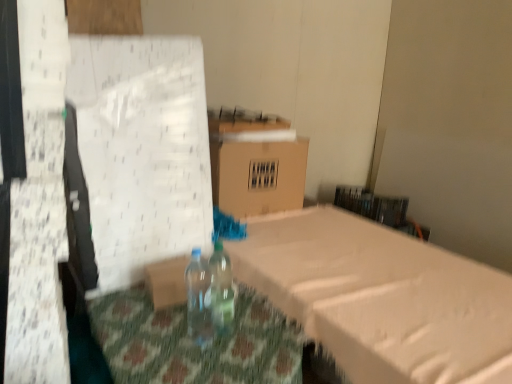
Question: Is transparent plastic bottle at center, the 2th bottle when ordered from left to right, behind brown cardboard box at center?

Choices:
 (A) no
 (B) yes

Answer: (A)

Question: From a real-world perspective, is transparent plastic bottle at center, the 2th bottle when ordered from left to right, on top of brown cardboard box at center?

Choices:
 (A) yes
 (B) no

Answer: (B)

Question: Can you confirm if transparent plastic bottle at center, the first bottle when ordered from right to left, is smaller than brown cardboard box at center?

Choices:
 (A) yes
 (B) no

Answer: (A)

Question: Is transparent plastic bottle at center, the first bottle when ordered from right to left, taller than brown cardboard box at center?

Choices:
 (A) yes
 (B) no

Answer: (B)

Question: Is transparent plastic bottle at center, the 2th bottle when ordered from left to right, located outside brown cardboard box at center?

Choices:
 (A) no
 (B) yes

Answer: (B)

Question: From a real-world perspective, is transparent plastic bottle at center, the first bottle when ordered from right to left, under brown cardboard box at center?

Choices:
 (A) yes
 (B) no

Answer: (A)

Question: From the image's perspective, is translucent plastic bottle at center, which is the second bottle in right-to-left order, on top of brown cardboard box at center?

Choices:
 (A) no
 (B) yes

Answer: (A)

Question: From a real-world perspective, is translucent plastic bottle at center, which is the second bottle in right-to-left order, under brown cardboard box at center?

Choices:
 (A) yes
 (B) no

Answer: (A)

Question: Does translucent plastic bottle at center, the 1th bottle from the left, come behind brown cardboard box at center?

Choices:
 (A) yes
 (B) no

Answer: (B)

Question: From a real-world perspective, is translucent plastic bottle at center, which is the second bottle in right-to-left order, positioned over brown cardboard box at center based on gravity?

Choices:
 (A) no
 (B) yes

Answer: (A)

Question: Does translucent plastic bottle at center, the 1th bottle from the left, come in front of brown cardboard box at center?

Choices:
 (A) yes
 (B) no

Answer: (A)

Question: Considering the relative positions of translucent plastic bottle at center, which is the second bottle in right-to-left order, and brown cardboard box at center in the image provided, is translucent plastic bottle at center, which is the second bottle in right-to-left order, to the right of brown cardboard box at center from the viewer's perspective?

Choices:
 (A) no
 (B) yes

Answer: (A)

Question: Can you confirm if brown cardboard box at center is taller than transparent plastic bottle at center, the first bottle when ordered from right to left?

Choices:
 (A) no
 (B) yes

Answer: (B)